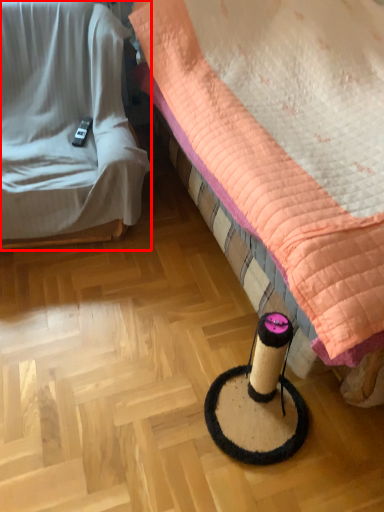
Question: Considering the relative positions of furniture (annotated by the red box) and bed in the image provided, where is furniture (annotated by the red box) located with respect to the staircase?

Choices:
 (A) right
 (B) left

Answer: (B)